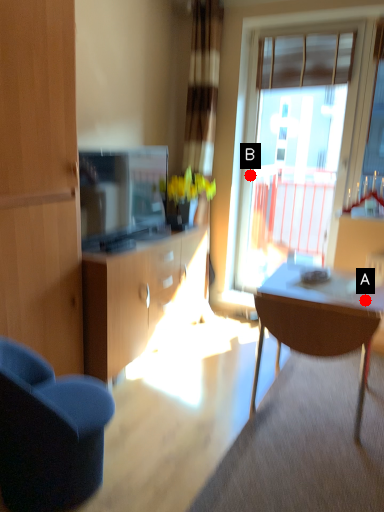
Question: Two points are circled on the image, labeled by A and B beside each circle. Which point is closer to the camera?

Choices:
 (A) A is closer
 (B) B is closer

Answer: (A)